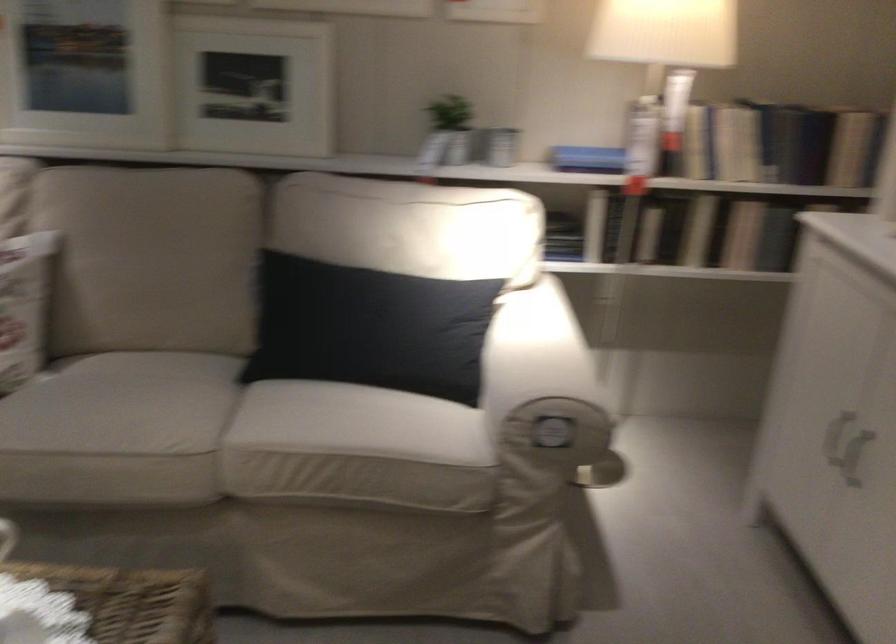
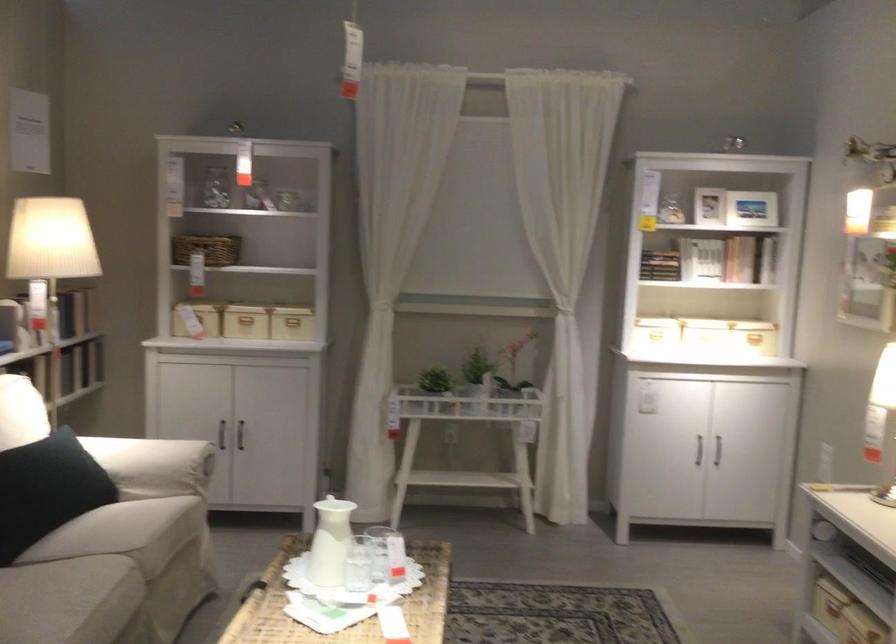
Locate, in the second image, the point that corresponds to pixel 333 324 in the first image.

(47, 489)